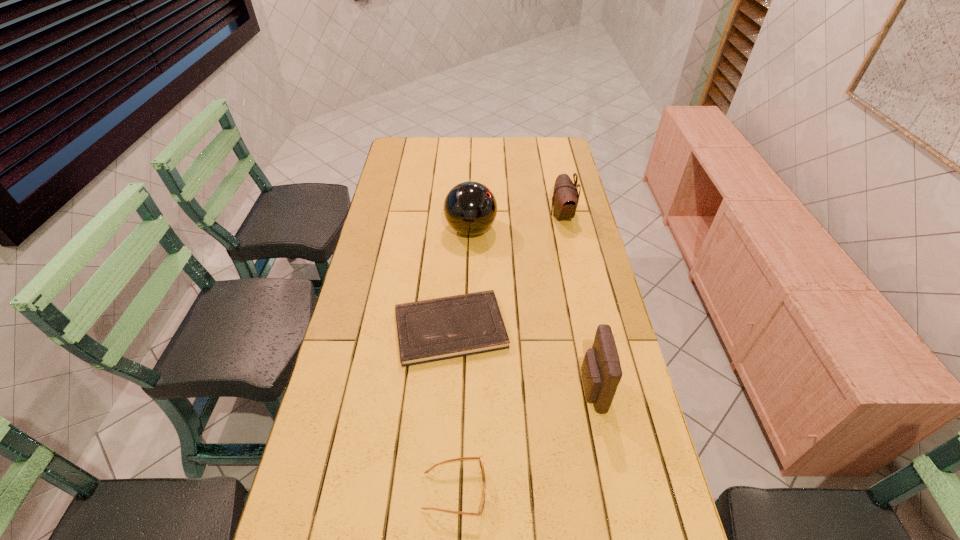
Where is `free space located with the flap open on the farther pouch`? The image size is (960, 540). free space located with the flap open on the farther pouch is located at coordinates (471, 215).

The width and height of the screenshot is (960, 540). I want to click on free point located with the flap open on the farther pouch, so click(x=529, y=215).

Find the location of `free space located 0.310m with the flap open on the farther pouch`. free space located 0.310m with the flap open on the farther pouch is located at coordinates [x=468, y=215].

The height and width of the screenshot is (540, 960). Find the location of `vacant space located on the front-facing side of the sunglasses`. vacant space located on the front-facing side of the sunglasses is located at coordinates (604, 491).

Identify the location of blank space located on the back of the paperback book. The height and width of the screenshot is (540, 960). (457, 224).

At what (x,y) coordinates should I click in order to perform the action: click on object situated at the left edge. Please return your answer as a coordinate pair (x, y). Image resolution: width=960 pixels, height=540 pixels. Looking at the image, I should click on (437, 329).

In the image, there is a desktop. Where is `vacant space at the far edge`? This screenshot has height=540, width=960. vacant space at the far edge is located at coordinates (475, 143).

Locate an element on the screen. The image size is (960, 540). free region at the left edge is located at coordinates (403, 214).

The width and height of the screenshot is (960, 540). Identify the location of vacant space at the right edge of the desktop. (580, 392).

Locate an element on the screen. free space between the bowling ball and the farther pouch is located at coordinates (516, 222).